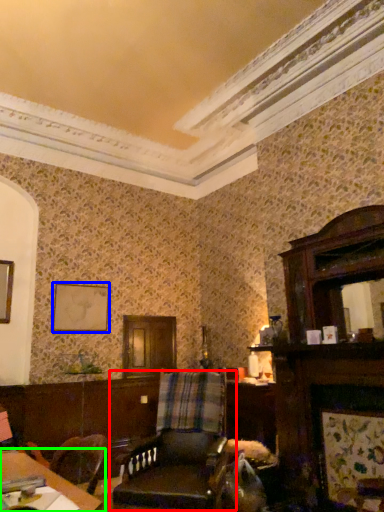
Question: Which is farther away from chair (highlighted by a red box)? picture frame (highlighted by a blue box) or table (highlighted by a green box)?

Choices:
 (A) picture frame
 (B) table

Answer: (A)